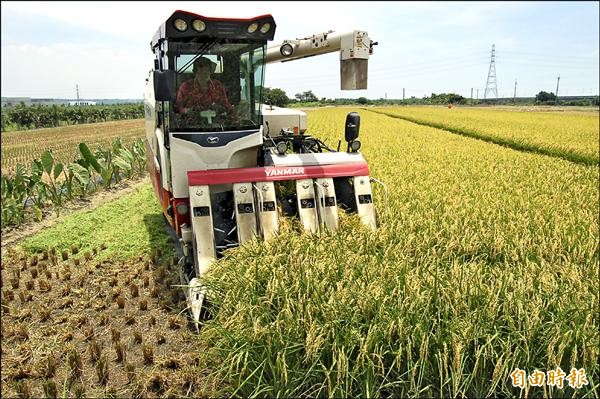
Locate an element on the screen. lights is located at coordinates (286, 50), (263, 25), (252, 27), (200, 22), (178, 25), (285, 147), (356, 146).